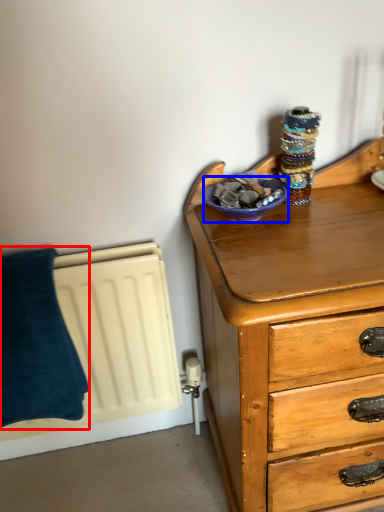
Question: Which of the following is the farthest to the observer, pillow (highlighted by a red box) or glass bowl (highlighted by a blue box)?

Choices:
 (A) pillow
 (B) glass bowl

Answer: (A)